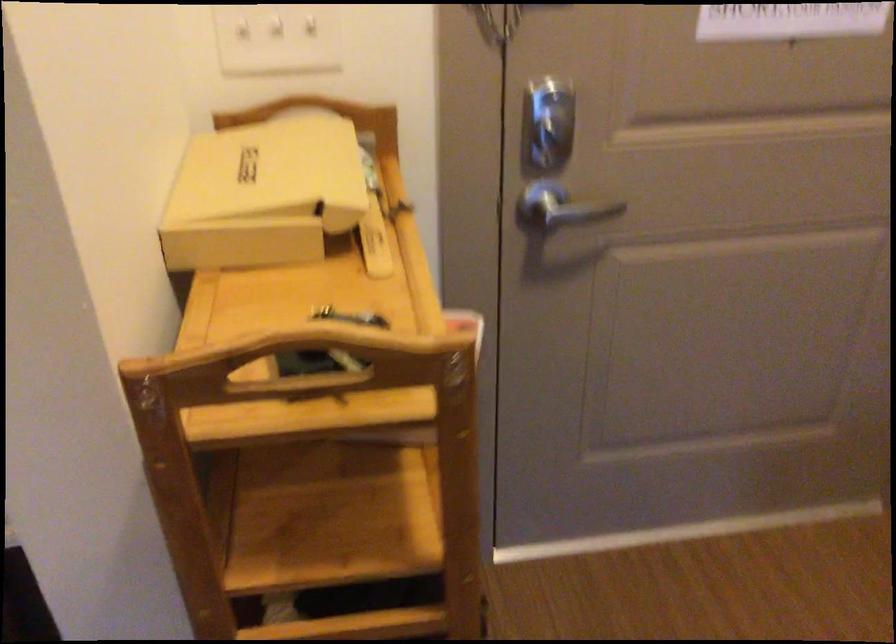
You are a GUI agent. You are given a task and a screenshot of the screen. Output one action in this format:
    pyautogui.click(x=<x>, y=<y>)
    Task: Click on the silver door handle
    Image resolution: width=896 pixels, height=644 pixels.
    Given the screenshot: What is the action you would take?
    pyautogui.click(x=558, y=210)